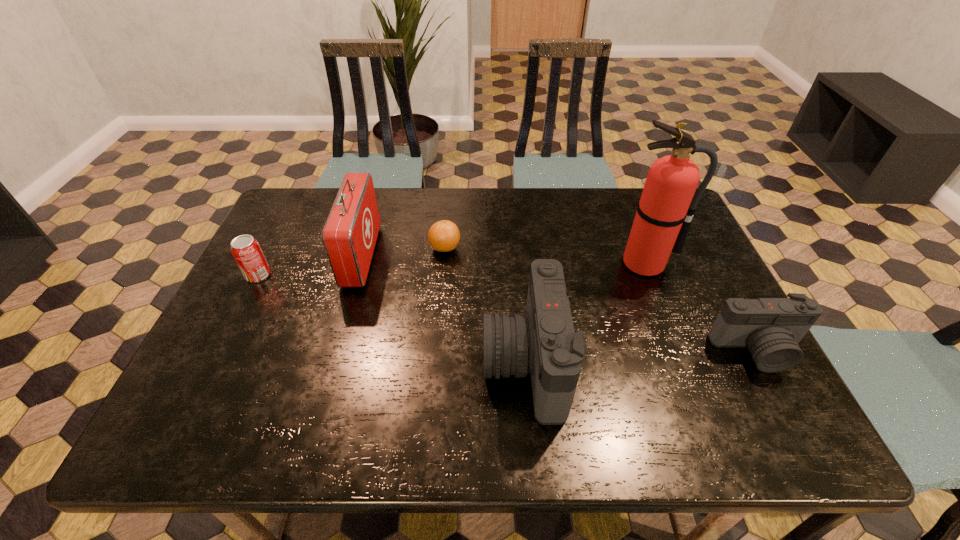
What are the coordinates of `the fourth shortest object` in the screenshot? It's located at point(543,342).

Image resolution: width=960 pixels, height=540 pixels. I want to click on the taller camera, so click(543, 342).

Where is `the shorter camera`? The width and height of the screenshot is (960, 540). the shorter camera is located at coordinates (771, 328).

Identify the location of the third object from left to right. (444, 236).

You are a GUI agent. You are given a task and a screenshot of the screen. Output one action in this format:
    pyautogui.click(x=<x>, y=<y>)
    Task: Click on the shortest object
    The width and height of the screenshot is (960, 540).
    Given the screenshot: What is the action you would take?
    pyautogui.click(x=444, y=236)

Find the location of `the first-aid kit`. the first-aid kit is located at coordinates [x=350, y=233].

The width and height of the screenshot is (960, 540). Find the location of `the second object from left to right`. the second object from left to right is located at coordinates (350, 233).

This screenshot has width=960, height=540. I want to click on the tallest object, so click(x=664, y=214).

Locate an element on the screen. Image resolution: width=960 pixels, height=540 pixels. the leftmost object is located at coordinates [x=246, y=250].

Find the location of a particular element. The image size is (960, 540). vacant space situated 0.070m at the lens of the fourth object from left to right is located at coordinates (452, 363).